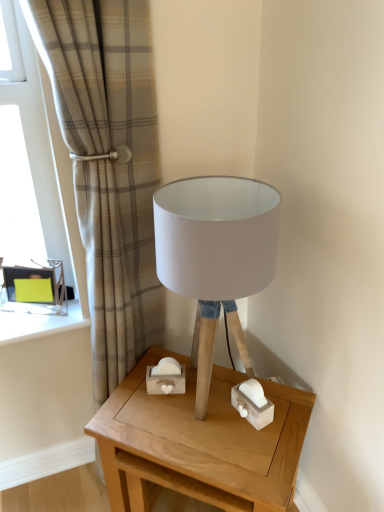
Question: From their relative heights in the image, would you say wooden table at center is taller or shorter than beige plaid curtain at upper left?

Choices:
 (A) tall
 (B) short

Answer: (B)

Question: Does point (109, 503) appear closer or farther from the camera than point (142, 344)?

Choices:
 (A) closer
 (B) farther

Answer: (A)

Question: Considering the real-world distances, which object is farthest from the wooden table at center?

Choices:
 (A) white fabric lampshade at center
 (B) matte glass window at left
 (C) beige plaid curtain at upper left
 (D) green cardboard box at left

Answer: (B)

Question: Which object is the closest to the green cardboard box at left?

Choices:
 (A) white fabric lampshade at center
 (B) wooden table at center
 (C) beige plaid curtain at upper left
 (D) matte glass window at left

Answer: (D)